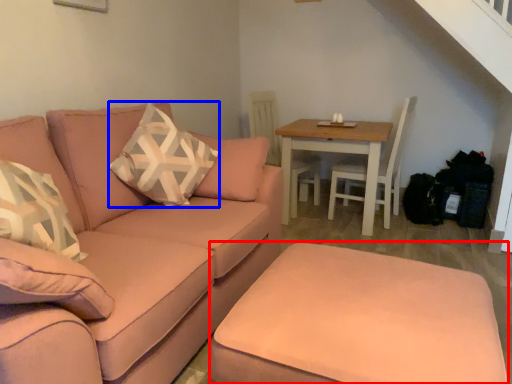
Question: Which object is further to the camera taking this photo, footrest (highlighted by a red box) or throw pillow (highlighted by a blue box)?

Choices:
 (A) footrest
 (B) throw pillow

Answer: (B)